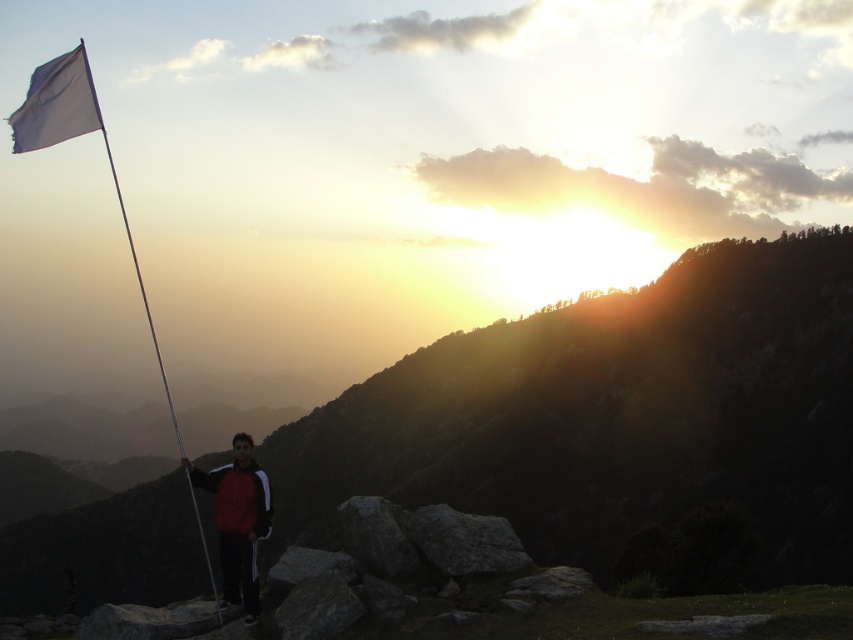
You are a hiker planning to place two markers at point [514,387] and point [129,244] in the scene. Which marker will be placed closer to your current position?

Point [514,387] is closer to the viewer than point [129,244], so the marker at point [514,387] will be closer to your current position.

You are a photographer trying to capture the scene. You want to ensure that both the matte black flag at upper left and the red jacket at center are in the same frame. Given that your camera has a 50mm lens, which has a field of view that can capture objects up to 30 meters apart in the same frame, will you be able to include both objects in your photo?

The matte black flag at upper left and the red jacket at center are 35.97 meters apart, which exceeds the 30 meters maximum distance your camera lens can capture in one frame. Therefore, you will not be able to include both objects in the same photo with the current lens.